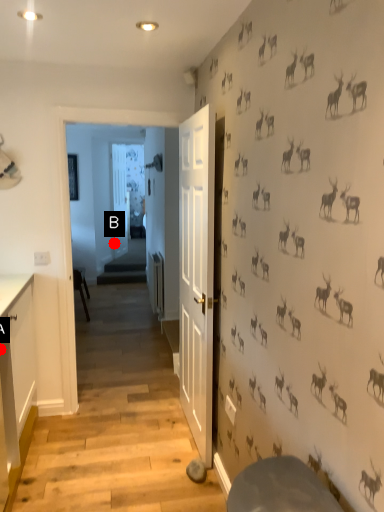
Question: Two points are circled on the image, labeled by A and B beside each circle. Which point is further to the camera?

Choices:
 (A) A is further
 (B) B is further

Answer: (B)